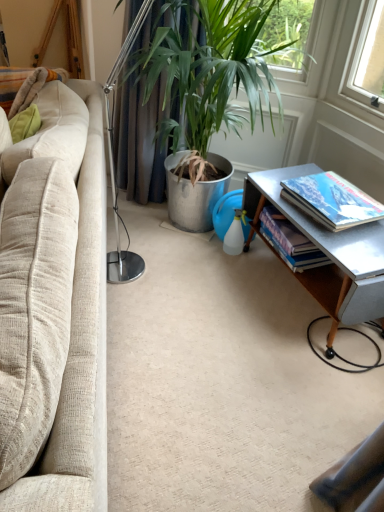
Question: Considering the relative sizes of beige fabric couch at left and metallic silver table at lower right in the image provided, is beige fabric couch at left bigger than metallic silver table at lower right?

Choices:
 (A) no
 (B) yes

Answer: (B)

Question: Considering the relative sizes of beige fabric couch at left and metallic silver table at lower right in the image provided, is beige fabric couch at left shorter than metallic silver table at lower right?

Choices:
 (A) no
 (B) yes

Answer: (A)

Question: Is beige fabric couch at left wider than metallic silver table at lower right?

Choices:
 (A) yes
 (B) no

Answer: (A)

Question: From the image's perspective, is beige fabric couch at left above metallic silver table at lower right?

Choices:
 (A) no
 (B) yes

Answer: (B)

Question: From a real-world perspective, is beige fabric couch at left over metallic silver table at lower right?

Choices:
 (A) no
 (B) yes

Answer: (B)

Question: Is the depth of beige fabric couch at left less than that of metallic silver table at lower right?

Choices:
 (A) no
 (B) yes

Answer: (B)

Question: Considering the relative sizes of beige fabric couch at left and hardcover book at right, which is counted as the 1th book, starting from the front, in the image provided, is beige fabric couch at left smaller than hardcover book at right, which is counted as the 1th book, starting from the front,?

Choices:
 (A) no
 (B) yes

Answer: (A)

Question: From the image's perspective, is beige fabric couch at left located above hardcover book at right, which is counted as the 1th book, starting from the front?

Choices:
 (A) no
 (B) yes

Answer: (A)

Question: From a real-world perspective, is beige fabric couch at left on top of hardcover book at right, which is counted as the 1th book, starting from the front?

Choices:
 (A) yes
 (B) no

Answer: (B)

Question: Is beige fabric couch at left taller than hardcover book at right, the second book in the back-to-front sequence?

Choices:
 (A) no
 (B) yes

Answer: (B)

Question: Is beige fabric couch at left completely or partially outside of hardcover book at right, the second book in the back-to-front sequence?

Choices:
 (A) no
 (B) yes

Answer: (B)

Question: Considering the relative sizes of beige fabric couch at left and hardcover book at right, which is counted as the 1th book, starting from the front, in the image provided, is beige fabric couch at left wider than hardcover book at right, which is counted as the 1th book, starting from the front,?

Choices:
 (A) yes
 (B) no

Answer: (A)

Question: Can you confirm if hardcover book at right, which is counted as the 1th book, starting from the front, is shorter than hardcover book at lower right, placed as the second book when sorted from front to back?

Choices:
 (A) yes
 (B) no

Answer: (A)